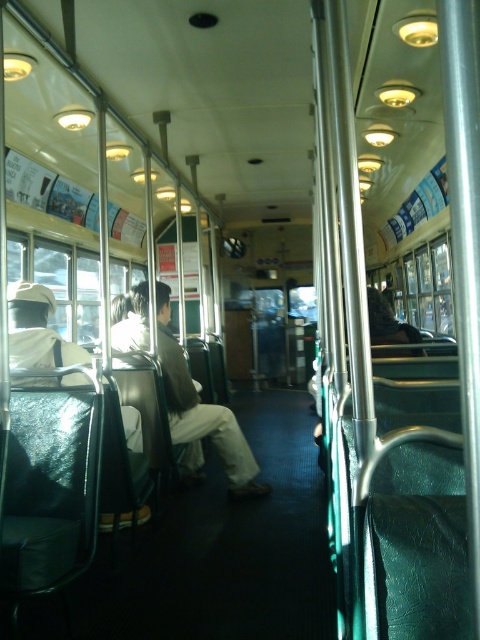
You are a passenger on the bus and you want to know if the light brown fabric pants at center can fit into the luggage compartment under the white matte uniform at left. Can you determine based on their sizes?

The light brown fabric pants at center is larger in size than the white matte uniform at left, so it may not fit into the luggage compartment under the white matte uniform at left unless there is sufficient space.

You are a passenger on a bus and need to sit down. You see the light brown fabric pants at center and the white matte uniform at left. Which seat is closer to the window?

The white matte uniform at left is closer to the window because the light brown fabric pants at center might be wider than the white matte uniform at left, indicating they are further away from the window.